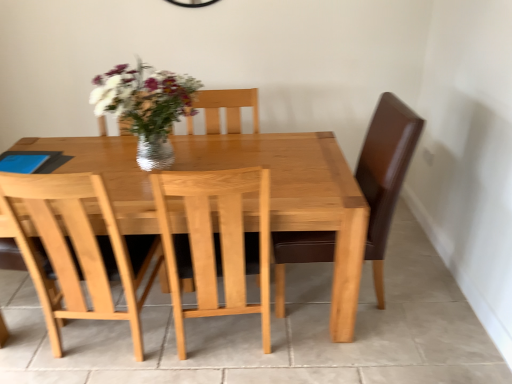
Question: Is light wood chair at center far away from light brown wooden table at center?

Choices:
 (A) no
 (B) yes

Answer: (A)

Question: Considering the relative sizes of light wood chair at center and light brown wooden table at center in the image provided, is light wood chair at center smaller than light brown wooden table at center?

Choices:
 (A) no
 (B) yes

Answer: (B)

Question: Could light brown wooden table at center be considered to be inside light wood chair at center?

Choices:
 (A) no
 (B) yes

Answer: (A)

Question: From a real-world perspective, is light wood chair at center over light brown wooden table at center?

Choices:
 (A) no
 (B) yes

Answer: (B)

Question: Is light wood chair at center completely or partially outside of light brown wooden table at center?

Choices:
 (A) yes
 (B) no

Answer: (B)

Question: Would you say light brown wooden table at center is to the left or to the right of light wood chair at center in the picture?

Choices:
 (A) left
 (B) right

Answer: (A)

Question: Based on their sizes in the image, would you say light brown wooden table at center is bigger or smaller than light wood chair at center?

Choices:
 (A) small
 (B) big

Answer: (B)

Question: From the image's perspective, is light brown wooden table at center located above or below light wood chair at center?

Choices:
 (A) below
 (B) above

Answer: (B)

Question: Considering their positions, is light brown wooden table at center located in front of or behind light wood chair at center?

Choices:
 (A) behind
 (B) front

Answer: (A)

Question: Considering the positions of point (137, 157) and point (266, 268), is point (137, 157) closer or farther from the camera than point (266, 268)?

Choices:
 (A) closer
 (B) farther

Answer: (B)

Question: Is shiny silver vase at center wider or thinner than light wood chair at center?

Choices:
 (A) wide
 (B) thin

Answer: (B)

Question: From a real-world perspective, relative to light wood chair at center, is shiny silver vase at center vertically above or below?

Choices:
 (A) above
 (B) below

Answer: (A)

Question: From the image's perspective, relative to light wood chair at center, is shiny silver vase at center above or below?

Choices:
 (A) below
 (B) above

Answer: (B)

Question: Looking at their shapes, would you say light wood chair at center is wider or thinner than shiny silver vase at center?

Choices:
 (A) thin
 (B) wide

Answer: (B)

Question: From their relative heights in the image, would you say light wood chair at center is taller or shorter than shiny silver vase at center?

Choices:
 (A) short
 (B) tall

Answer: (B)